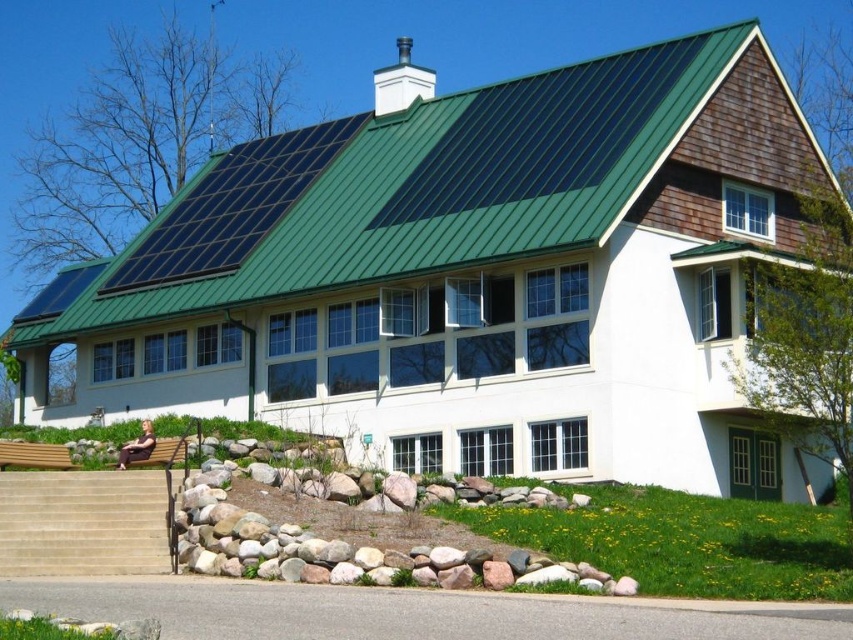
Question: Is green metal roof at center above beige stone stairs at lower left?

Choices:
 (A) no
 (B) yes

Answer: (B)

Question: Which point is farther from the camera taking this photo?

Choices:
 (A) (44, 529)
 (B) (404, 147)

Answer: (B)

Question: Which point is closer to the camera?

Choices:
 (A) (642, 129)
 (B) (45, 573)

Answer: (B)

Question: Which object appears farthest from the camera in this image?

Choices:
 (A) beige stone stairs at lower left
 (B) green metal roof at center

Answer: (B)

Question: Can you confirm if green metal roof at center is positioned to the right of beige stone stairs at lower left?

Choices:
 (A) yes
 (B) no

Answer: (A)

Question: Where is green metal roof at center located in relation to beige stone stairs at lower left in the image?

Choices:
 (A) right
 (B) left

Answer: (A)